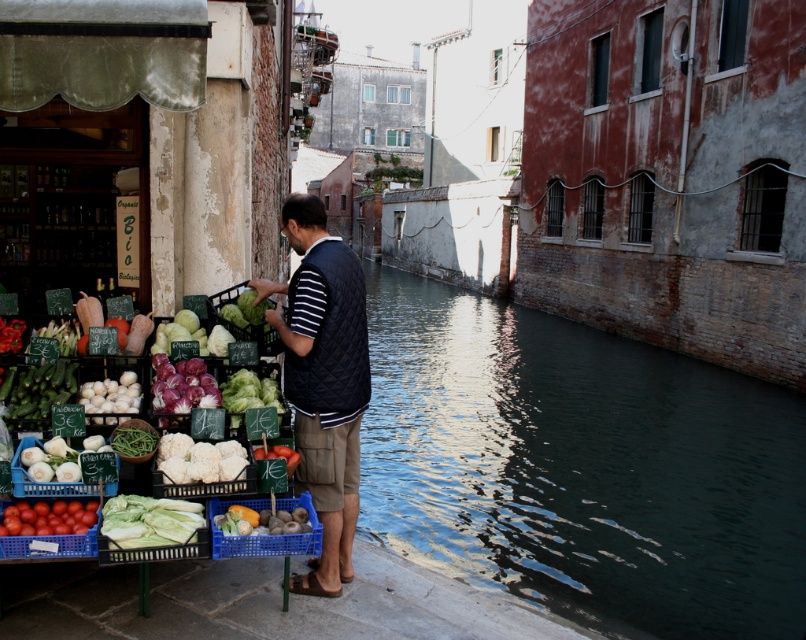
Question: Is dark blue quilted vest at center positioned before ripe red tomato at lower left?

Choices:
 (A) yes
 (B) no

Answer: (B)

Question: Which object is positioned closest to the matte green cabbage at left?

Choices:
 (A) purple glossy onion at left
 (B) dark green water at canal center
 (C) green leafy lettuce at center

Answer: (A)

Question: Which of these objects is positioned closest to the matte green cabbage at left?

Choices:
 (A) smooth brown kiwi at center
 (B) white matte onions at left

Answer: (A)

Question: Is dark green water at canal center wider than purple glossy onion at left?

Choices:
 (A) yes
 (B) no

Answer: (A)

Question: Which point is closer to the camera taking this photo?

Choices:
 (A) (152, 360)
 (B) (23, 380)
 (C) (285, 460)

Answer: (C)

Question: Does purple glossy onion at left appear over smooth red tomato at center?

Choices:
 (A) no
 (B) yes

Answer: (B)